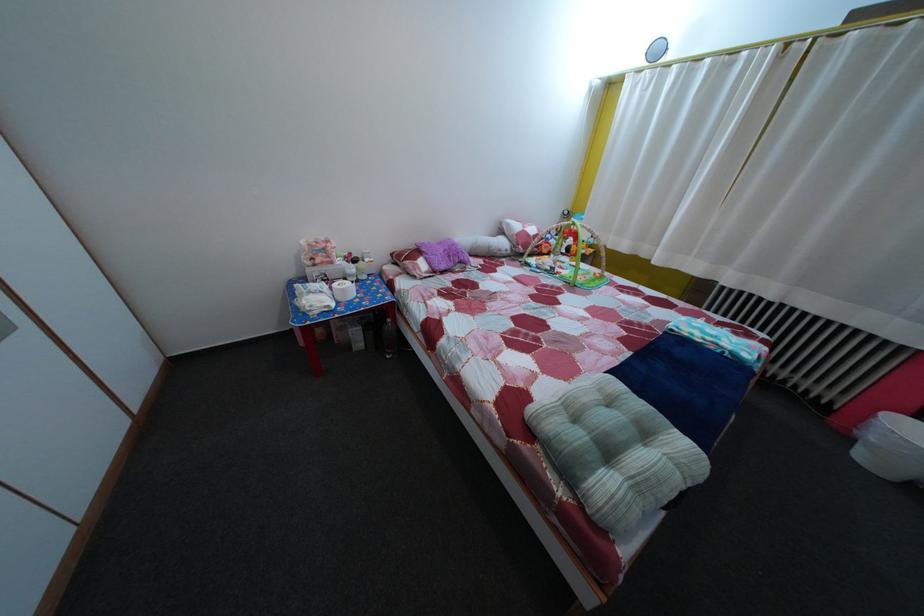
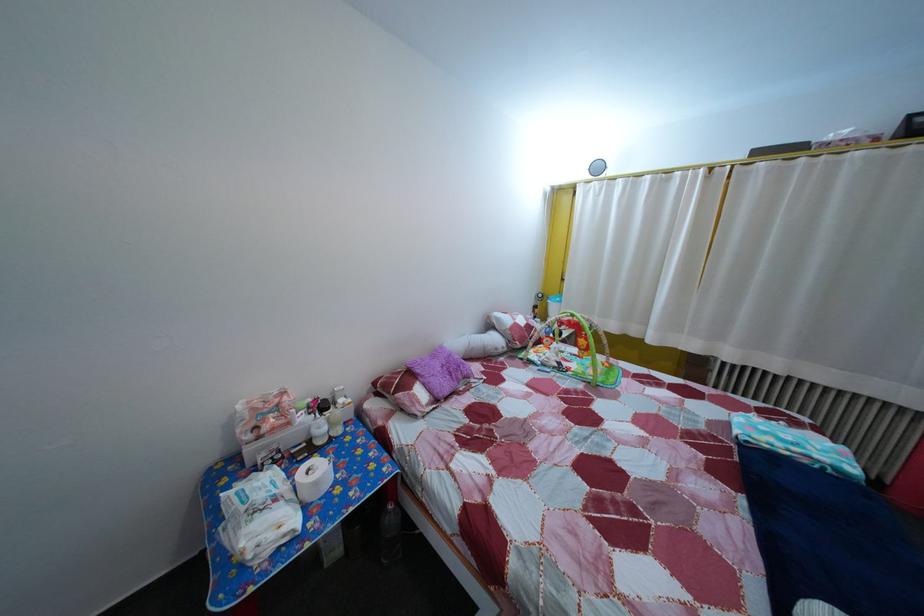
Locate, in the second image, the point that corresponds to (x=397, y=328) in the first image.

(399, 515)